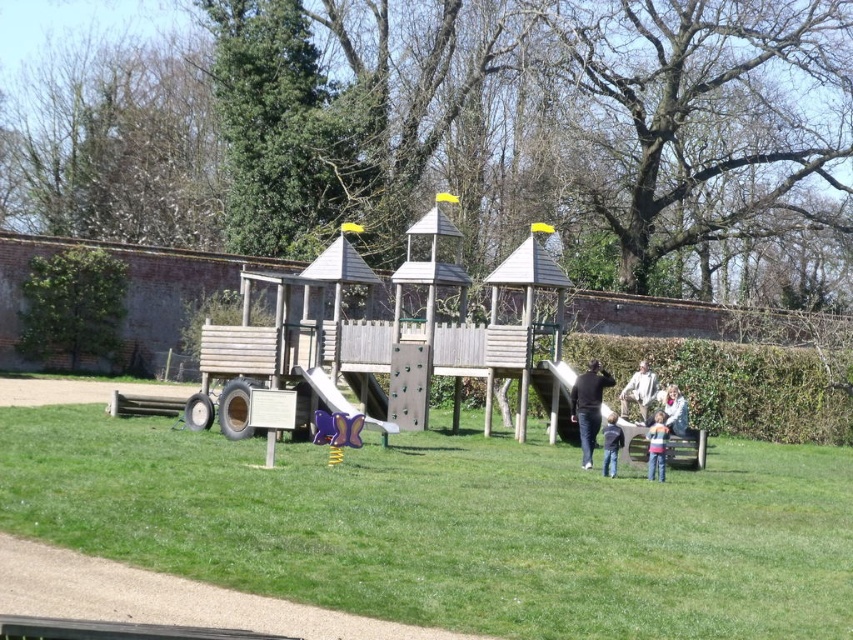
You are a parent trying to locate your child who is wearing a striped cotton shirt at lower right and another child wearing a white fuzzy jacket at lower right. From your vantage point, which child is standing more to the left?

The striped cotton shirt at lower right is positioned on the left side of white fuzzy jacket at lower right, so the child wearing the striped cotton shirt at lower right is standing more to the left.

You are a parent watching your child play at the playground. You see the purple plastic slide at center and the blue denim jeans at center. Which object is located higher up?

The purple plastic slide at center is positioned over blue denim jeans at center, so it is higher up.